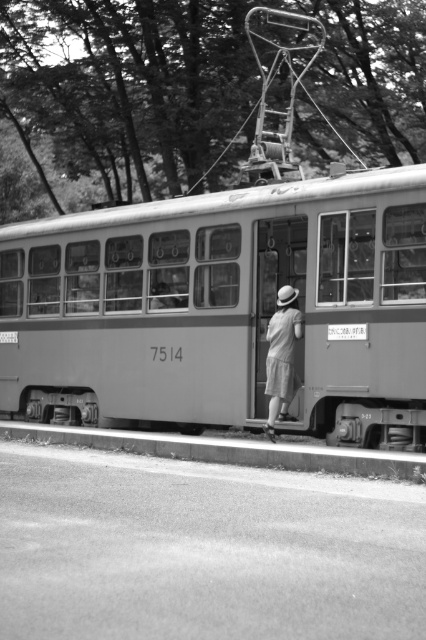
Between metallic gray tram at center and light gray cotton shorts at center, which one is positioned higher?

metallic gray tram at center is higher up.

Based on the photo, does metallic gray tram at center appear on the right side of light gray cotton shorts at center?

In fact, metallic gray tram at center is to the left of light gray cotton shorts at center.

This screenshot has width=426, height=640. Identify the location of metallic gray tram at center. (224, 308).

I want to click on metallic gray tram at center, so click(x=224, y=308).

Can you confirm if metallic gray tram at center is positioned to the right of smooth concrete curb at lower center?

In fact, metallic gray tram at center is to the left of smooth concrete curb at lower center.

Which is in front, point (155, 348) or point (351, 474)?

Positioned in front is point (351, 474).

Where is `metallic gray tram at center`? metallic gray tram at center is located at coordinates (224, 308).

Looking at this image, is smooth concrete curb at lower center shorter than light gray cotton shorts at center?

Yes.

Can you confirm if smooth concrete curb at lower center is positioned below light gray cotton shorts at center?

Indeed, smooth concrete curb at lower center is positioned under light gray cotton shorts at center.

Is point (80, 433) less distant than point (273, 326)?

That is False.

Where is `smooth concrete curb at lower center`? Image resolution: width=426 pixels, height=640 pixels. smooth concrete curb at lower center is located at coordinates (229, 451).